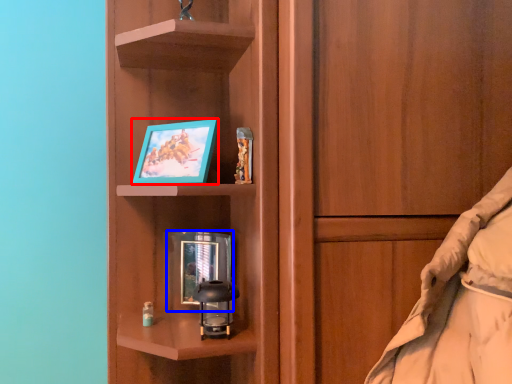
Question: Among these objects, which one is farthest to the camera, picture frame (highlighted by a red box) or picture frame (highlighted by a blue box)?

Choices:
 (A) picture frame
 (B) picture frame

Answer: (B)